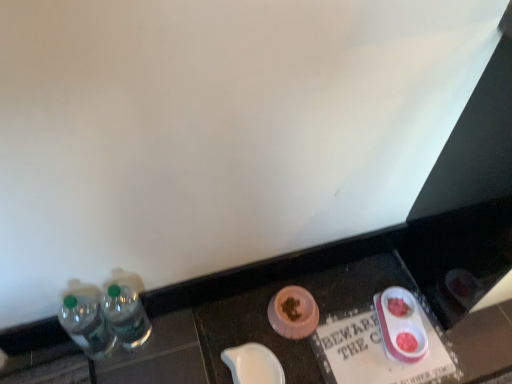
The width and height of the screenshot is (512, 384). In order to click on free spot behind pink plastic food bowls at lower right, placed as the second tableware when sorted from left to right in this screenshot , I will do `click(373, 273)`.